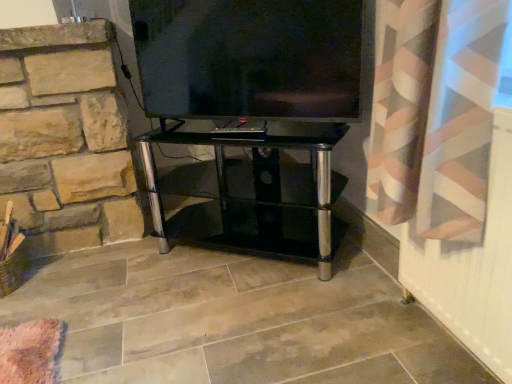
Question: Considering the relative sizes of flat screen tv at center and black glass tv stand at center in the image provided, is flat screen tv at center bigger than black glass tv stand at center?

Choices:
 (A) no
 (B) yes

Answer: (A)

Question: Can you confirm if flat screen tv at center is positioned to the right of black glass tv stand at center?

Choices:
 (A) no
 (B) yes

Answer: (B)

Question: Can we say flat screen tv at center lies outside black glass tv stand at center?

Choices:
 (A) yes
 (B) no

Answer: (A)

Question: Does flat screen tv at center have a lesser width compared to black glass tv stand at center?

Choices:
 (A) no
 (B) yes

Answer: (B)

Question: Is black glass tv stand at center inside flat screen tv at center?

Choices:
 (A) no
 (B) yes

Answer: (A)

Question: From the image's perspective, would you say flat screen tv at center is positioned over black glass tv stand at center?

Choices:
 (A) no
 (B) yes

Answer: (B)

Question: From the image's perspective, is black glass tv stand at center located above flat screen tv at center?

Choices:
 (A) yes
 (B) no

Answer: (B)

Question: Could flat screen tv at center be considered to be inside black glass tv stand at center?

Choices:
 (A) no
 (B) yes

Answer: (A)

Question: Is black glass tv stand at center facing towards flat screen tv at center?

Choices:
 (A) no
 (B) yes

Answer: (A)

Question: Does black glass tv stand at center have a greater height compared to flat screen tv at center?

Choices:
 (A) yes
 (B) no

Answer: (A)

Question: From a real-world perspective, does black glass tv stand at center sit lower than flat screen tv at center?

Choices:
 (A) yes
 (B) no

Answer: (A)

Question: Is black glass tv stand at center positioned far away from flat screen tv at center?

Choices:
 (A) yes
 (B) no

Answer: (B)

Question: Is flat screen tv at center situated inside black glass tv stand at center or outside?

Choices:
 (A) inside
 (B) outside

Answer: (B)